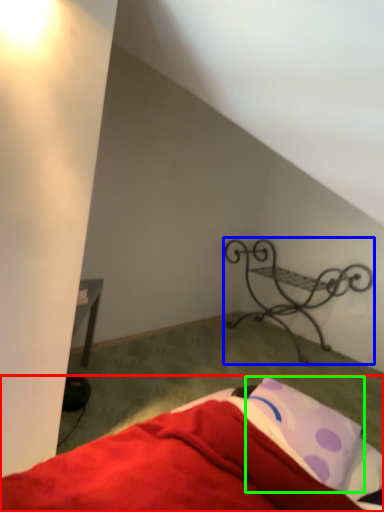
Question: Based on their relative distances, which object is nearer to bed (highlighted by a red box)? Choose from furniture (highlighted by a blue box) and pillow (highlighted by a green box).

Choices:
 (A) furniture
 (B) pillow

Answer: (B)